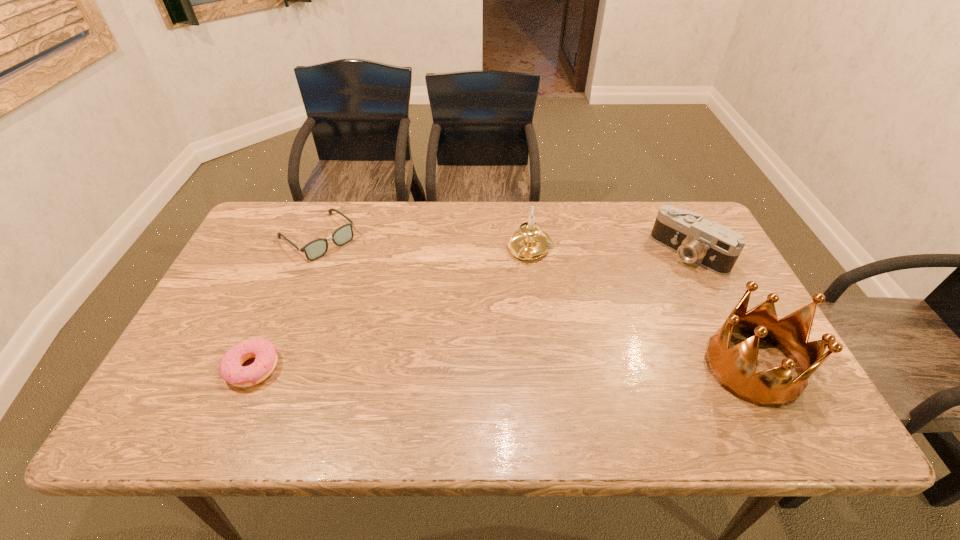
Identify the location of vacant spot on the desktop that is between the shortest object and the crown and is positioned on the handle side of the candle holder. (455, 367).

Locate an element on the screen. The width and height of the screenshot is (960, 540). free space on the desktop that is between the shortest object and the crown and is positioned on the face of the second shortest object is located at coordinates (457, 367).

Where is `vacant spot on the desktop that is between the shortest object and the crown and is positioned on the lens of the third shortest object`? This screenshot has width=960, height=540. vacant spot on the desktop that is between the shortest object and the crown and is positioned on the lens of the third shortest object is located at coordinates (566, 367).